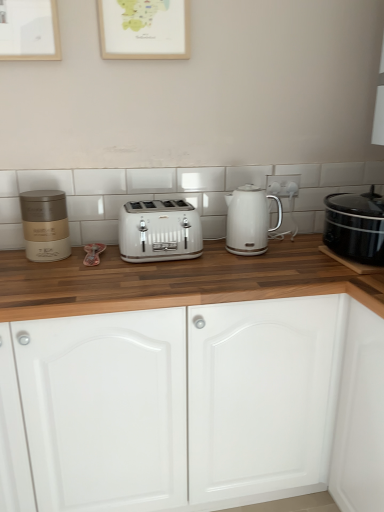
Locate an element on the screen. vacant area that is in front of white metallic toaster at center is located at coordinates (152, 276).